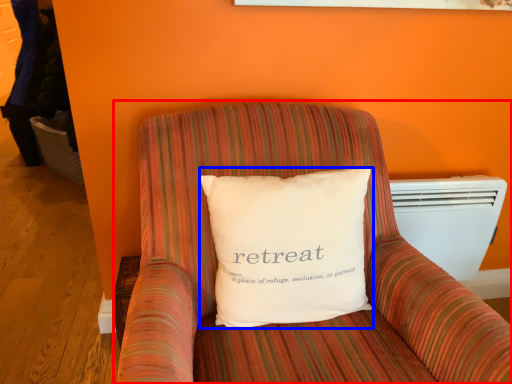
Question: Which object appears farthest to the camera in this image, furniture (highlighted by a red box) or pillow (highlighted by a blue box)?

Choices:
 (A) furniture
 (B) pillow

Answer: (B)